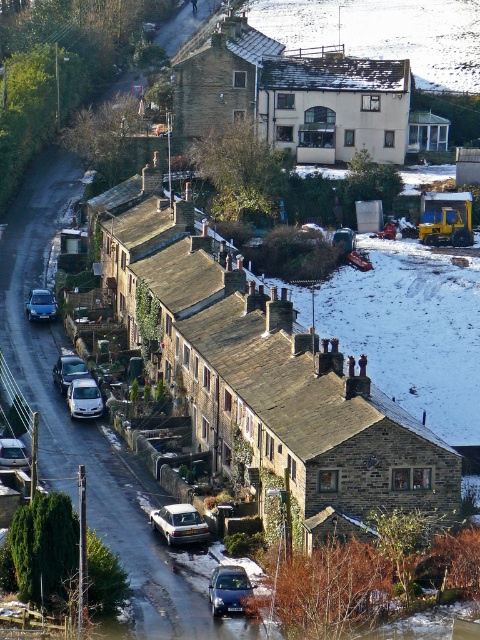
You are a delivery driver who needs to park your van, which is 6 meters long, between the white matte car at lower center and the silver metallic car at lower left. Is there enough space between them to park your van?

The white matte car at lower center and silver metallic car at lower left are 8.86 meters apart, so yes, the van can fit between them since the space is longer than the van.